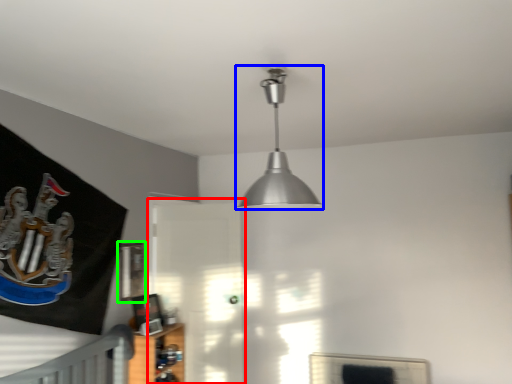
Question: Which is farther away from glass door (highlighted by a red box)? lamp (highlighted by a blue box) or picture frame (highlighted by a green box)?

Choices:
 (A) lamp
 (B) picture frame

Answer: (A)